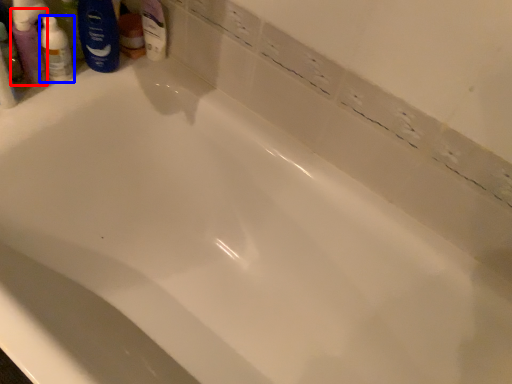
Question: Which point is further to the camera, mouthwash (highlighted by a red box) or toiletry (highlighted by a blue box)?

Choices:
 (A) mouthwash
 (B) toiletry

Answer: (B)